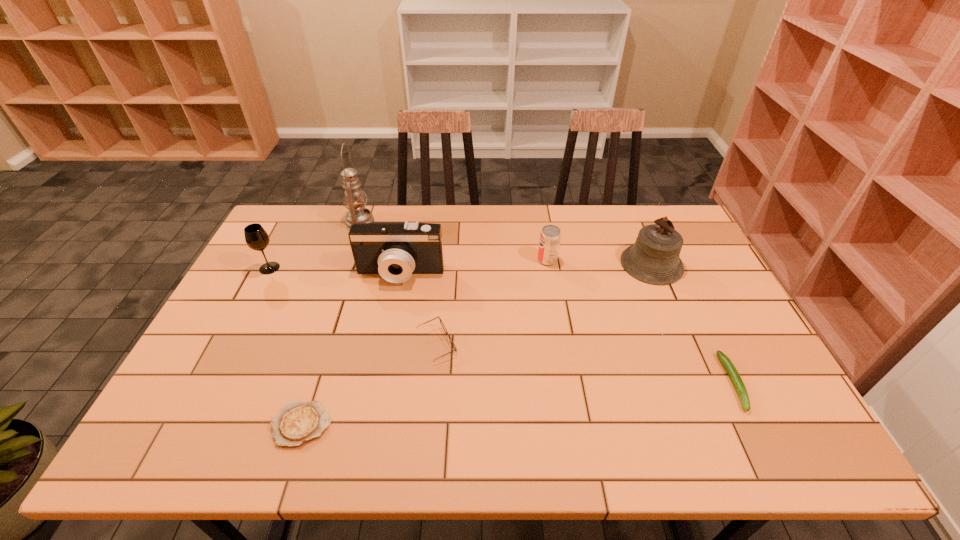
Identify the location of object present at the near edge. (298, 422).

Where is `object located at the left edge`? Image resolution: width=960 pixels, height=540 pixels. object located at the left edge is located at coordinates (256, 237).

The image size is (960, 540). I want to click on bell that is at the right edge, so click(654, 258).

Identify the location of zucchini that is positioned at the right edge. This screenshot has width=960, height=540. (741, 390).

Where is `object that is positioned at the far right corner`? This screenshot has height=540, width=960. object that is positioned at the far right corner is located at coordinates (654, 258).

This screenshot has height=540, width=960. I want to click on vacant space at the far edge of the desktop, so click(x=572, y=210).

I want to click on vacant region at the left edge, so click(x=284, y=290).

Locate an element on the screen. The height and width of the screenshot is (540, 960). vacant space at the right edge of the desktop is located at coordinates (x=731, y=321).

Locate an element on the screen. free point at the far left corner is located at coordinates (287, 242).

In the image, there is a desktop. Identify the location of vacant space at the near right corner. (802, 431).